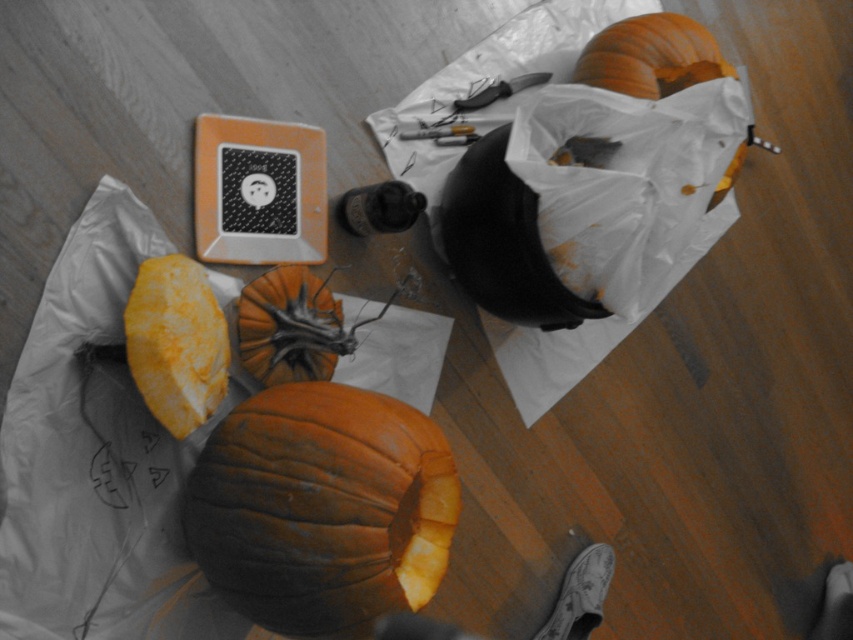
You are standing in the pumpkin carving area and want to pick up the pumpkin rind piece that is closest to you. Which object corresponds to the point at coordinates point (289, 378)?

The point (289, 378) is 1.16 meters from the viewer, so the pumpkin rind piece at that point is the closest to you.

You are setting up a Halloween display and need to arrange two pumpkins. You have an orange matte pumpkin at lower left and an orange matte pumpkin at upper right. Which pumpkin should you place on the wider shelf to fit better?

The orange matte pumpkin at upper right has a greater width than the orange matte pumpkin at lower left, so it should be placed on the wider shelf to fit better.

Where is the orange matte pumpkin at lower left located in the image?

The orange matte pumpkin at lower left is located at point (177, 342).